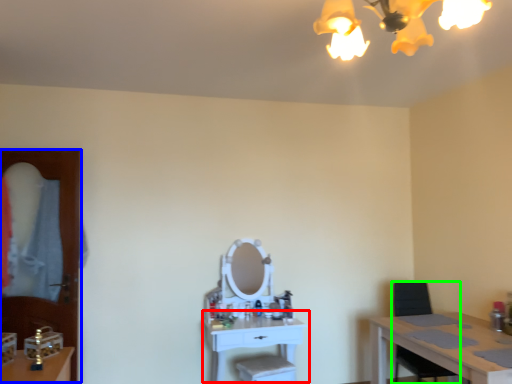
Question: Based on their relative distances, which object is nearer to table (highlighted by a red box)? Choose from glass door (highlighted by a blue box) and armchair (highlighted by a green box).

Choices:
 (A) glass door
 (B) armchair

Answer: (B)